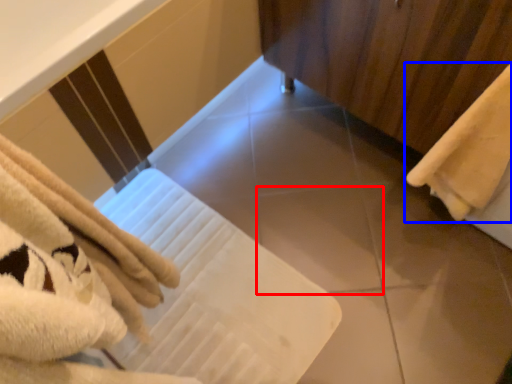
Question: Among these objects, which one is nearest to the camera, tile (highlighted by a red box) or towel (highlighted by a blue box)?

Choices:
 (A) tile
 (B) towel

Answer: (B)